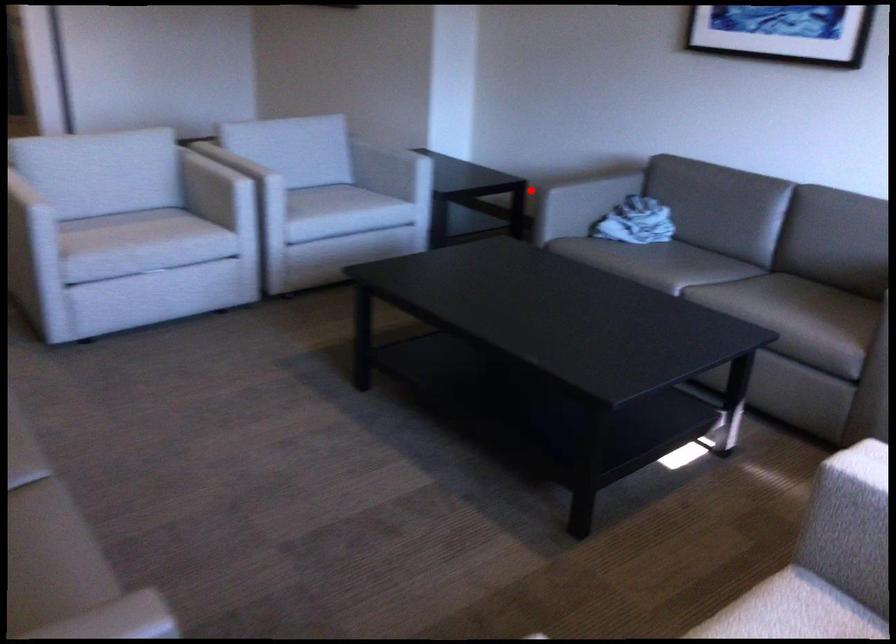
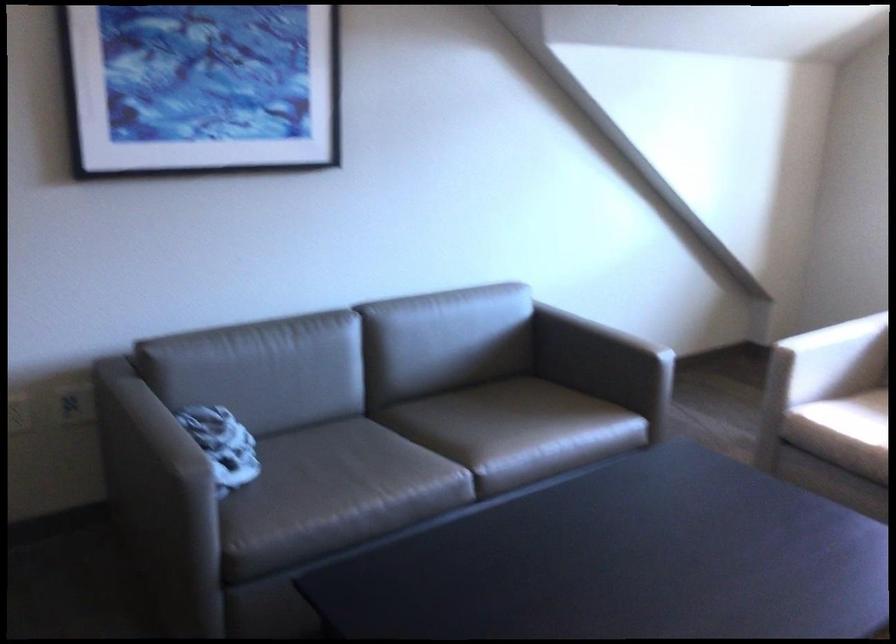
Question: A red point is marked in image1. In image2, is the corresponding 3D point closer to the camera or farther? Reply with the corresponding letter.

Choices:
 (A) The corresponding 3D point is closer.
 (B) The corresponding 3D point is farther.

Answer: (A)